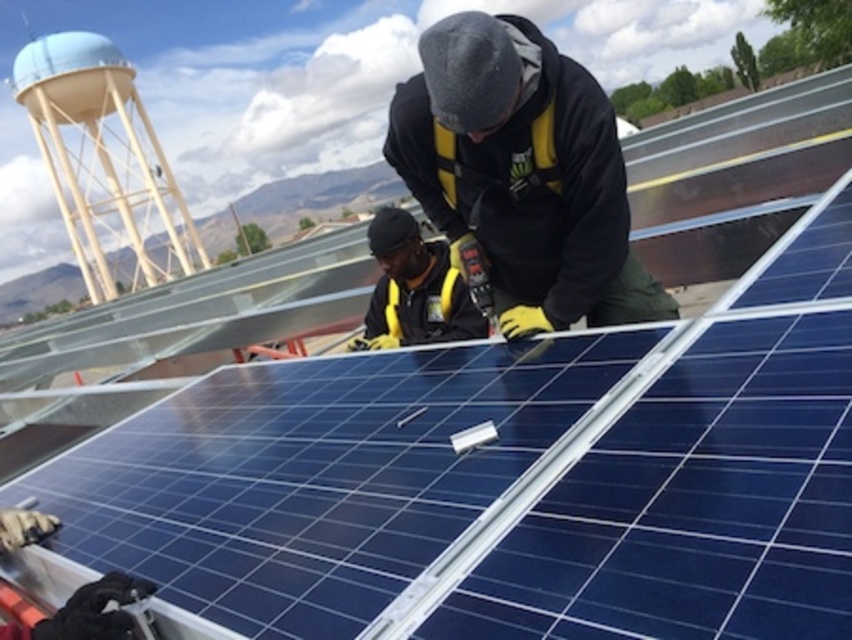
Question: Among these objects, which one is farthest from the camera?

Choices:
 (A) yellow safety vest at center
 (B) yellow reflective safety vest at center

Answer: (A)

Question: Does yellow reflective safety vest at center come in front of white matte water tower at upper left?

Choices:
 (A) no
 (B) yes

Answer: (B)

Question: Which object is the farthest from the yellow reflective safety vest at center?

Choices:
 (A) yellow safety vest at center
 (B) white matte water tower at upper left

Answer: (B)

Question: Does white matte water tower at upper left have a larger size compared to yellow safety vest at center?

Choices:
 (A) no
 (B) yes

Answer: (B)

Question: Can you confirm if yellow reflective safety vest at center is bigger than yellow safety vest at center?

Choices:
 (A) no
 (B) yes

Answer: (B)

Question: Which point is farther to the camera?

Choices:
 (A) yellow safety vest at center
 (B) yellow reflective safety vest at center
 (C) white matte water tower at upper left

Answer: (C)